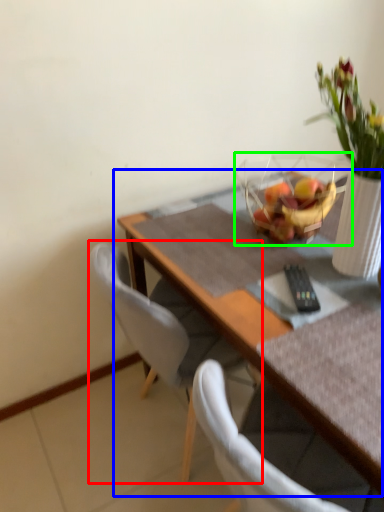
Question: Which object is the closest to the chair (highlighted by a red box)? Choose among these: table (highlighted by a blue box) or basket (highlighted by a green box).

Choices:
 (A) table
 (B) basket

Answer: (A)